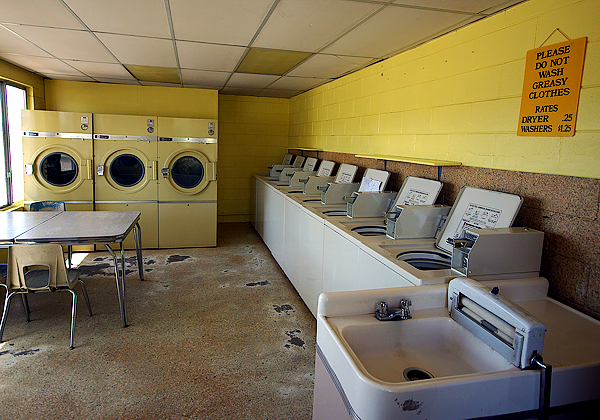
You are a GUI agent. You are given a task and a screenshot of the screen. Output one action in this format:
    pyautogui.click(x=<x>, y=<y>)
    Task: Click on the wall
    This screenshot has height=420, width=600.
    Given the screenshot: What is the action you would take?
    pyautogui.click(x=413, y=90)